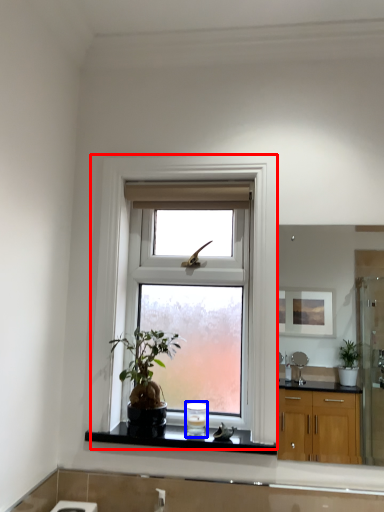
Question: Which of the following is the farthest to the observer, window (highlighted by a red box) or appliance (highlighted by a blue box)?

Choices:
 (A) window
 (B) appliance

Answer: (B)